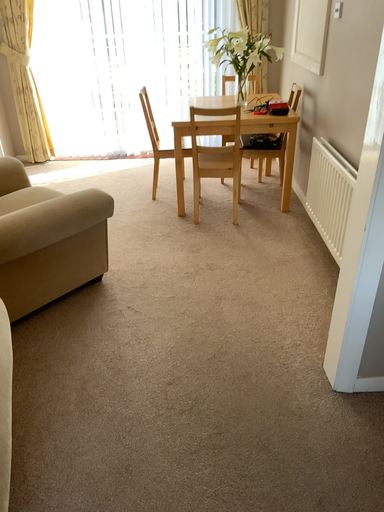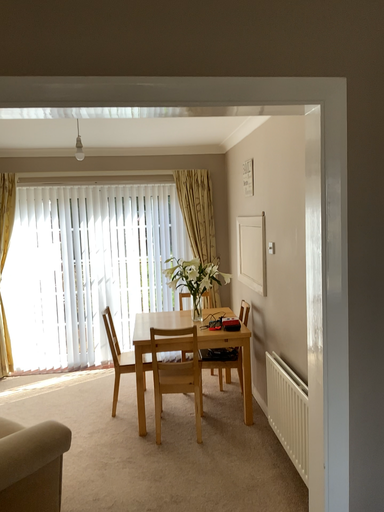
Question: Which way did the camera rotate in the video?

Choices:
 (A) rotated downward
 (B) rotated upward

Answer: (B)